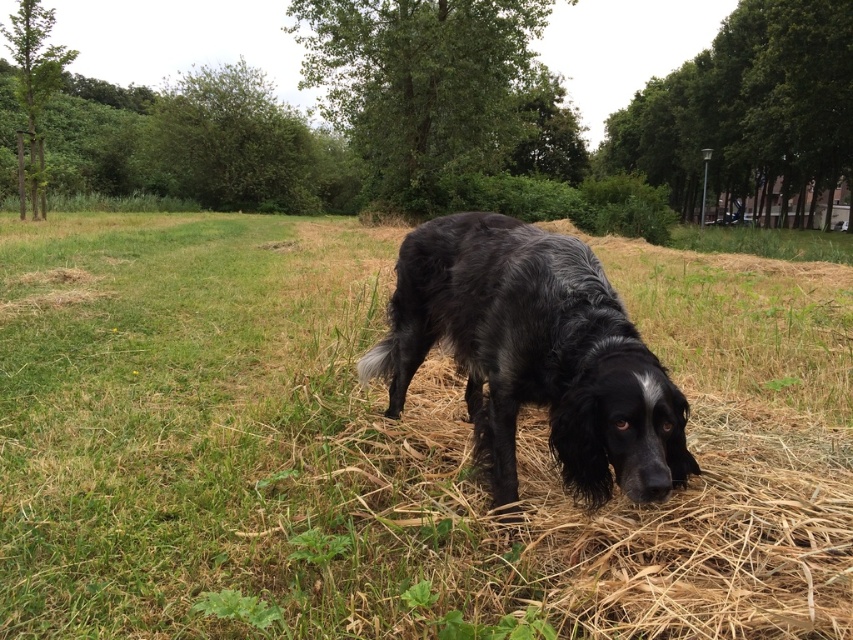
Is point (160, 433) positioned behind point (646, 376)?

Yes, it is.

Which is more to the right, black fur dog at center or black shaggy dog at center?

black shaggy dog at center

This screenshot has width=853, height=640. Identify the location of black fur dog at center. (390, 448).